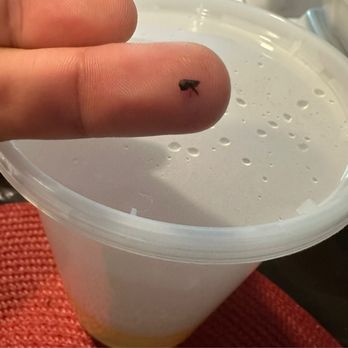
This screenshot has width=348, height=348. I want to click on plastic container lid, so click(x=180, y=204).